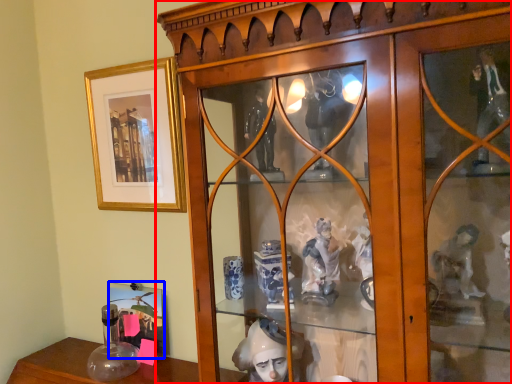
Question: Which of the following is the closest to the observer, furniture (highlighted by a red box) or picture frame (highlighted by a blue box)?

Choices:
 (A) furniture
 (B) picture frame

Answer: (A)